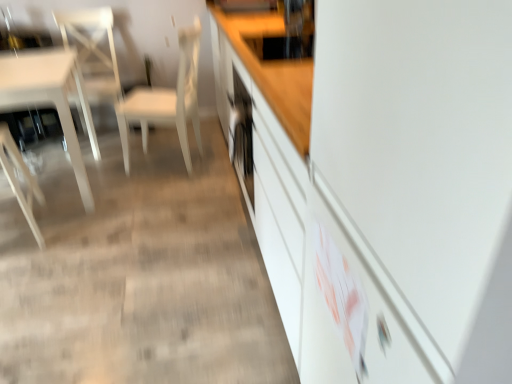
Measure the distance between point (155, 99) and camera.

They are 2.83 meters apart.

Find the location of a particular element. The width and height of the screenshot is (512, 384). wooden chair at left, the 1th chair in the left-to-right sequence is located at coordinates (18, 181).

Based on the photo, considering the sizes of objects white glossy table at left and white glossy chair at left, the 2th chair when ordered from left to right, in the image provided, who is smaller, white glossy table at left or white glossy chair at left, the 2th chair when ordered from left to right,?

white glossy chair at left, the 2th chair when ordered from left to right, is smaller.

Is point (48, 104) less distant than point (87, 17)?

No, (48, 104) is further to viewer.

Is white glossy table at left turned away from white glossy chair at left, the 2th chair when ordered from right to left?

Yes, white glossy table at left is facing away from white glossy chair at left, the 2th chair when ordered from right to left.

Could you measure the distance between white matte chair at center, acting as the 1th chair starting from the right, and wooden chair at left, which appears as the third chair when viewed from the right?

A distance of 32.94 inches exists between white matte chair at center, acting as the 1th chair starting from the right, and wooden chair at left, which appears as the third chair when viewed from the right.

Who is taller, white matte chair at center, acting as the 1th chair starting from the right, or wooden chair at left, the 1th chair in the left-to-right sequence?

Standing taller between the two is white matte chair at center, acting as the 1th chair starting from the right.

From the image's perspective, is white matte chair at center, positioned as the 3th chair in left-to-right order, on wooden chair at left, the 1th chair in the left-to-right sequence?

Yes, from the image's perspective, white matte chair at center, positioned as the 3th chair in left-to-right order, is over wooden chair at left, the 1th chair in the left-to-right sequence.

Based on the photo, can you tell me how much white matte chair at center, acting as the 1th chair starting from the right, and wooden chair at left, the 1th chair in the left-to-right sequence, differ in facing direction?

white matte chair at center, acting as the 1th chair starting from the right, and wooden chair at left, the 1th chair in the left-to-right sequence, are facing 62.1 degrees away from each other.

Between point (94, 136) and point (13, 189), which one is positioned behind?

Positioned behind is point (94, 136).

From a real-world perspective, is white glossy table at left below wooden chair at left, which appears as the third chair when viewed from the right?

Yes.

Considering their positions, is white glossy table at left located in front of or behind wooden chair at left, which appears as the third chair when viewed from the right?

Visually, white glossy table at left is located behind wooden chair at left, which appears as the third chair when viewed from the right.

Who is shorter, white glossy table at left or wooden chair at left, which appears as the third chair when viewed from the right?

white glossy table at left.

From a real-world perspective, which is physically above, white glossy cabinet at center or white matte chair at center, positioned as the 3th chair in left-to-right order?

white glossy cabinet at center, from a real-world perspective.

Considering the relative positions of white glossy cabinet at center and white matte chair at center, positioned as the 3th chair in left-to-right order, in the image provided, is white glossy cabinet at center in front of white matte chair at center, positioned as the 3th chair in left-to-right order,?

Yes.

From the image's perspective, between white glossy cabinet at center and white matte chair at center, positioned as the 3th chair in left-to-right order, which one is located above?

From the image's view, white matte chair at center, positioned as the 3th chair in left-to-right order, is above.

Is white glossy cabinet at center to the left of white matte chair at center, positioned as the 3th chair in left-to-right order, from the viewer's perspective?

No, white glossy cabinet at center is not to the left of white matte chair at center, positioned as the 3th chair in left-to-right order.

Based on their positions, is wooden chair at left, the 1th chair in the left-to-right sequence, located to the left or right of white glossy table at left?

wooden chair at left, the 1th chair in the left-to-right sequence, is to the right of white glossy table at left.

Could you measure the distance between wooden chair at left, which appears as the third chair when viewed from the right, and white glossy table at left?

wooden chair at left, which appears as the third chair when viewed from the right, and white glossy table at left are 18.80 inches apart from each other.

From the image's perspective, relative to white glossy table at left, is wooden chair at left, the 1th chair in the left-to-right sequence, above or below?

wooden chair at left, the 1th chair in the left-to-right sequence, is situated lower than white glossy table at left in the image.

Do you think wooden chair at left, the 1th chair in the left-to-right sequence, is within white glossy table at left, or outside of it?

The correct answer is: inside.

Which is more to the right, white glossy chair at left, the 2th chair when ordered from left to right, or white matte chair at center, positioned as the 3th chair in left-to-right order?

From the viewer's perspective, white matte chair at center, positioned as the 3th chair in left-to-right order, appears more on the right side.

Is white glossy chair at left, the 2th chair when ordered from right to left, facing towards white matte chair at center, positioned as the 3th chair in left-to-right order?

No, white glossy chair at left, the 2th chair when ordered from right to left, is not facing towards white matte chair at center, positioned as the 3th chair in left-to-right order.

In the scene shown: Is the depth of white glossy chair at left, the 2th chair when ordered from left to right, greater than that of white matte chair at center, positioned as the 3th chair in left-to-right order?

Yes.

Is white matte chair at center, positioned as the 3th chair in left-to-right order, wider or thinner than white glossy cabinet at center?

Considering their sizes, white matte chair at center, positioned as the 3th chair in left-to-right order, looks slimmer than white glossy cabinet at center.

Can you tell me how much white matte chair at center, acting as the 1th chair starting from the right, and white glossy cabinet at center differ in facing direction?

15.5 degrees separate the facing orientations of white matte chair at center, acting as the 1th chair starting from the right, and white glossy cabinet at center.

Is white matte chair at center, acting as the 1th chair starting from the right, facing away from white glossy cabinet at center?

That's right, white matte chair at center, acting as the 1th chair starting from the right, is facing away from white glossy cabinet at center.

Locate an element on the screen. This screenshot has height=384, width=512. the 1st chair to the left of the white glossy cabinet at center, starting your count from the anchor is located at coordinates (166, 101).

The image size is (512, 384). In order to click on table located in front of the white glossy chair at left, the 2th chair when ordered from left to right in this screenshot , I will do `click(51, 99)`.

From the wooden chair at left, which appears as the third chair when viewed from the right, count 1st chairs backward and point to it. Please provide its 2D coordinates.

[(166, 101)]

Looking at the image, which one is located closer to white matte chair at center, acting as the 1th chair starting from the right, white glossy chair at left, the 2th chair when ordered from right to left, or wooden chair at left, the 1th chair in the left-to-right sequence?

white glossy chair at left, the 2th chair when ordered from right to left, is positioned closer to the anchor white matte chair at center, acting as the 1th chair starting from the right.

When comparing their distances from white glossy cabinet at center, does white glossy chair at left, the 2th chair when ordered from left to right, or white glossy table at left seem closer?

white glossy table at left.

From the image, which object appears to be farther from white glossy chair at left, the 2th chair when ordered from right to left, wooden chair at left, which appears as the third chair when viewed from the right, or white matte chair at center, acting as the 1th chair starting from the right?

Among the two, wooden chair at left, which appears as the third chair when viewed from the right, is located further to white glossy chair at left, the 2th chair when ordered from right to left.

Which object lies further to the anchor point white glossy cabinet at center, wooden chair at left, which appears as the third chair when viewed from the right, or white glossy chair at left, the 2th chair when ordered from right to left?

white glossy chair at left, the 2th chair when ordered from right to left.

Estimate the real-world distances between objects in this image. Which object is closer to wooden chair at left, which appears as the third chair when viewed from the right, white glossy chair at left, the 2th chair when ordered from right to left, or white glossy cabinet at center?

white glossy chair at left, the 2th chair when ordered from right to left, is closer to wooden chair at left, which appears as the third chair when viewed from the right.

When comparing their distances from wooden chair at left, which appears as the third chair when viewed from the right, does white glossy chair at left, the 2th chair when ordered from left to right, or white glossy table at left seem closer?

white glossy table at left lies closer to wooden chair at left, which appears as the third chair when viewed from the right, than the other object.

Based on their spatial positions, is wooden chair at left, which appears as the third chair when viewed from the right, or white glossy cabinet at center further from white glossy table at left?

white glossy cabinet at center is positioned further to the anchor white glossy table at left.

Based on their spatial positions, is white glossy table at left or wooden chair at left, the 1th chair in the left-to-right sequence, closer to white glossy cabinet at center?

white glossy table at left is positioned closer to the anchor white glossy cabinet at center.

Find the location of `chair between wooden chair at left, which appears as the third chair when viewed from the right, and white glossy chair at left, the 2th chair when ordered from right to left, along the z-axis`. chair between wooden chair at left, which appears as the third chair when viewed from the right, and white glossy chair at left, the 2th chair when ordered from right to left, along the z-axis is located at coordinates tap(166, 101).

Find the location of a particular element. table between wooden chair at left, which appears as the third chair when viewed from the right, and white glossy chair at left, the 2th chair when ordered from left to right, along the z-axis is located at coordinates (51, 99).